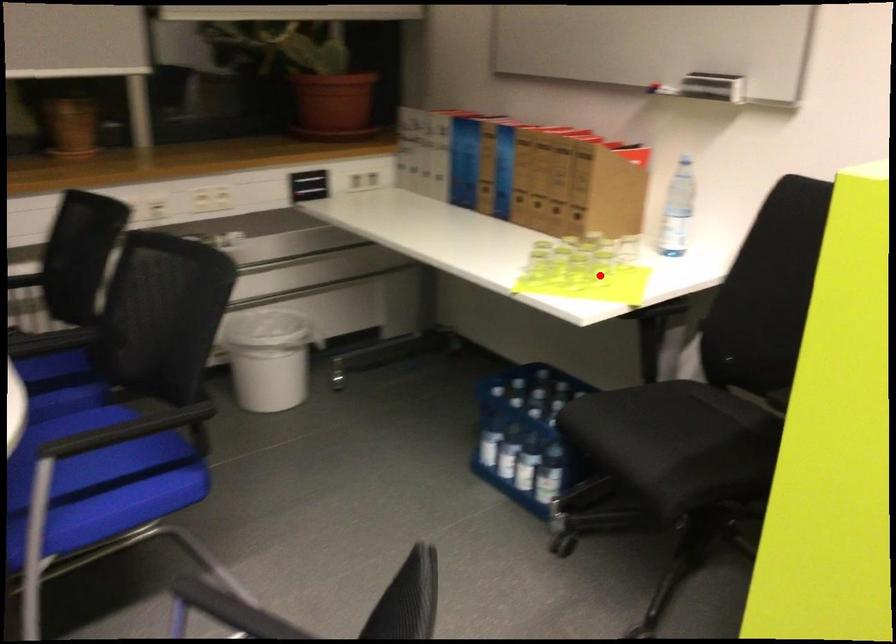
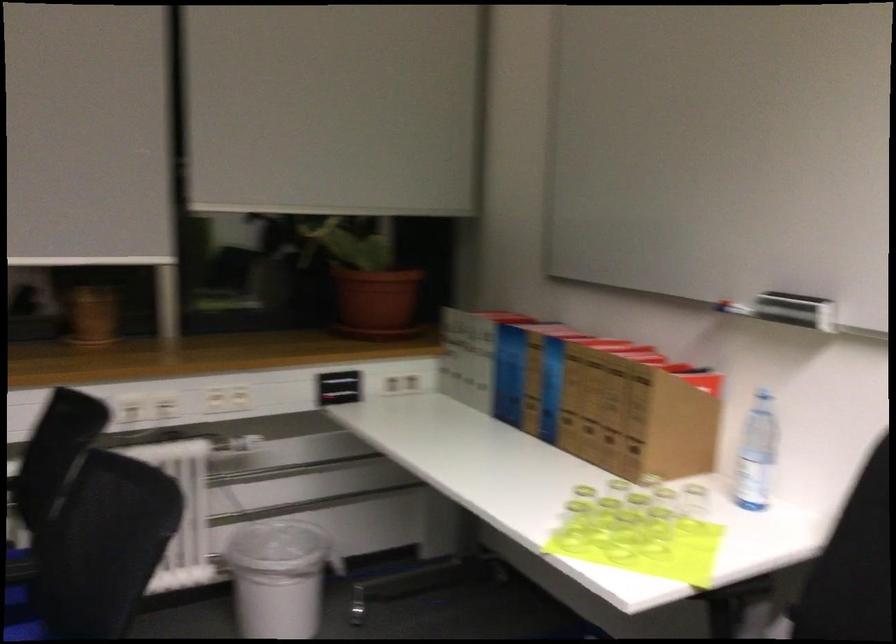
Where in the second image is the point corresponding to the highlighted location from the first image?

(655, 534)